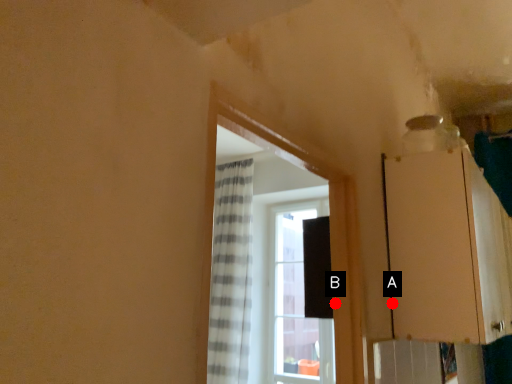
Question: Two points are circled on the image, labeled by A and B beside each circle. Among these points, which one is farthest from the camera?

Choices:
 (A) A is further
 (B) B is further

Answer: (A)